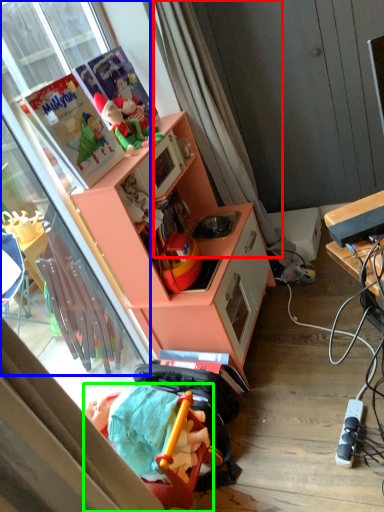
Question: Which object is positioned closest to curtain (highlighted by a red box)? Select from glass door (highlighted by a blue box) and toy (highlighted by a green box).

Choices:
 (A) glass door
 (B) toy

Answer: (A)